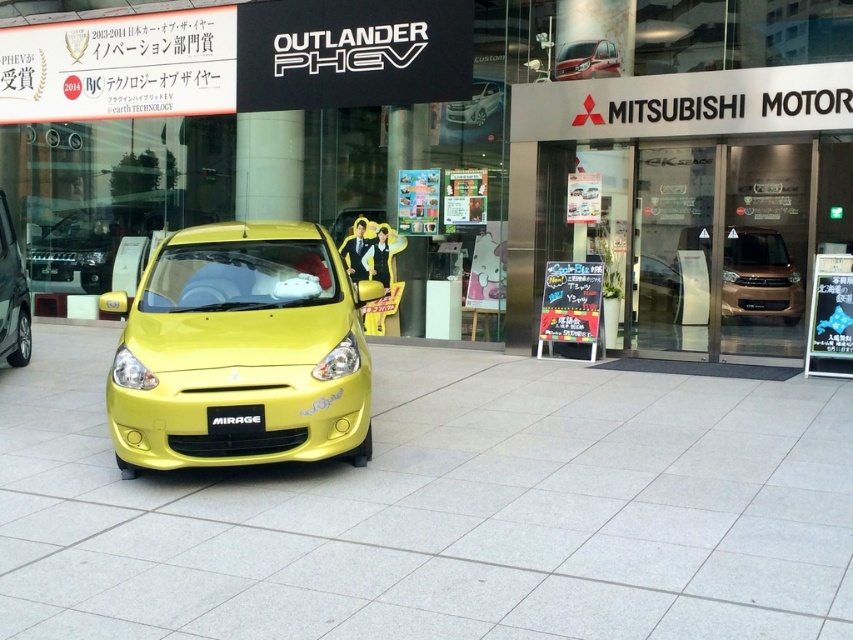
Question: In this image, where is metallic yellow car at center located relative to matte red car at upper right?

Choices:
 (A) below
 (B) above

Answer: (A)

Question: Considering the real-world distances, which object is farthest from the gold metallic suv at center?

Choices:
 (A) metallic silver suv at upper center
 (B) yellow matte license plate at center
 (C) yellow matte hatchback at center

Answer: (C)

Question: Is metallic yellow car at center thinner than gold metallic suv at center?

Choices:
 (A) yes
 (B) no

Answer: (B)

Question: Can you confirm if yellow matte hatchback at center is positioned below metallic silver suv at upper center?

Choices:
 (A) no
 (B) yes

Answer: (B)

Question: Which object is the closest to the yellow matte hatchback at center?

Choices:
 (A) yellow matte license plate at center
 (B) metallic yellow car at center
 (C) gold metallic suv at center
 (D) metallic silver suv at upper center

Answer: (B)

Question: Which point is farther to the camera?

Choices:
 (A) (596, 74)
 (B) (160, 444)
 (C) (15, 260)
 (D) (236, 433)

Answer: (A)